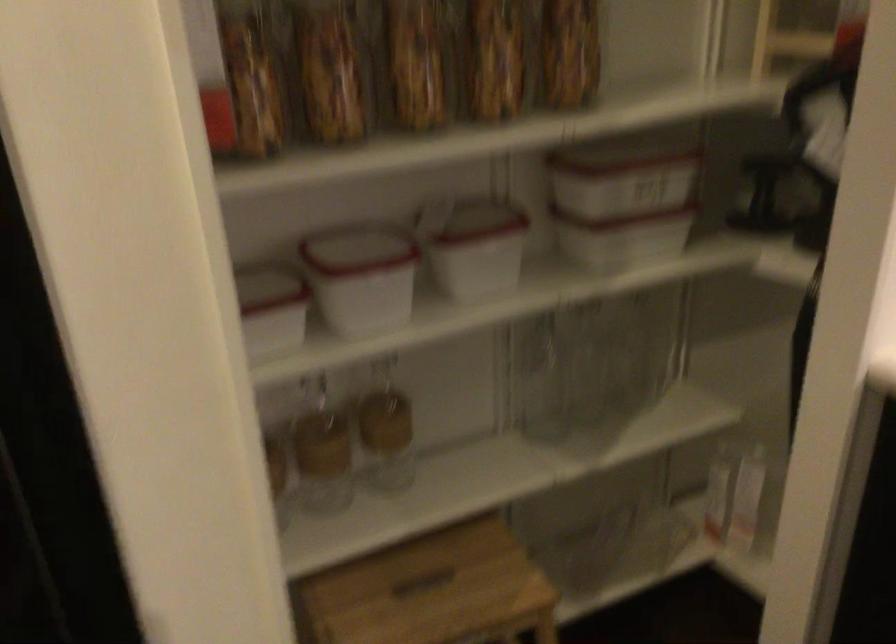
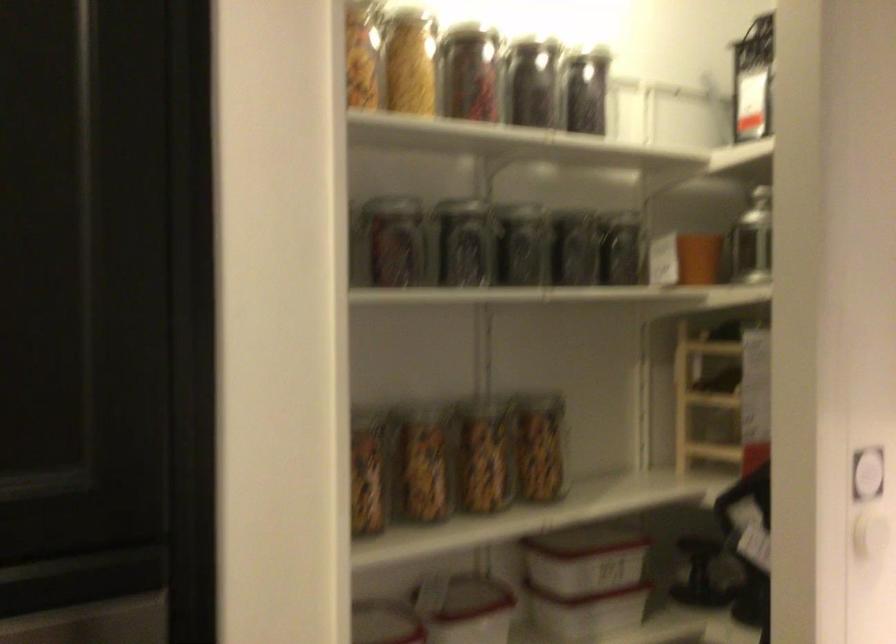
Question: I am providing you with two images of the same scene from different viewpoints. Please identify which objects are invisible in image2.

Choices:
 (A) white storage container
 (B) small terracotta pot
 (C) glass jar
 (D) white chair lever

Answer: (C)